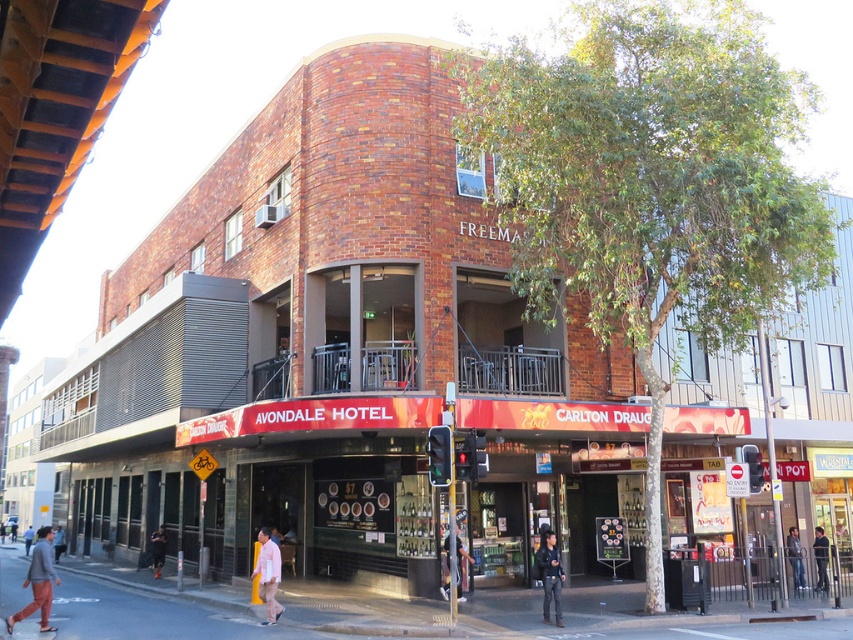
You are standing on the sidewalk in front of the Avondale Hotel and notice a person wearing a pink fabric shirt at lower center and light blue jeans at lower left. Which piece of clothing is on the right side from your perspective?

The pink fabric shirt at lower center is positioned on the right side of light blue jeans at lower left, so the pink fabric shirt at lower center is on the right side from your perspective.

You are standing on the street looking at the Avondale Hotel. You notice two pairs of pants hanging on a clothesline between two balconies. Which pair of pants is closer to you, the gray cotton pants at lower left or the dark gray pants at lower left?

The gray cotton pants at lower left are closer to you because they are positioned closer to the viewer than the dark gray pants at lower left according to the description.